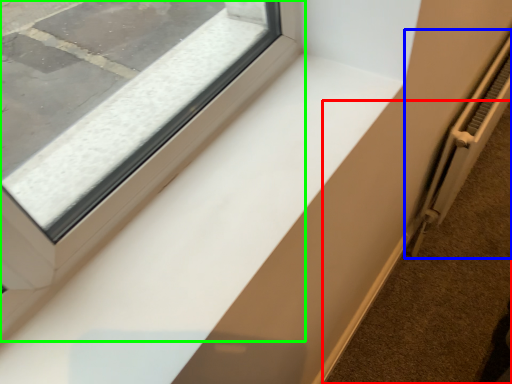
Question: Estimate the real-world distances between objects in this image. Which object is farther from pavement (highlighted by a red box), radiator (highlighted by a blue box) or window (highlighted by a green box)?

Choices:
 (A) radiator
 (B) window

Answer: (B)